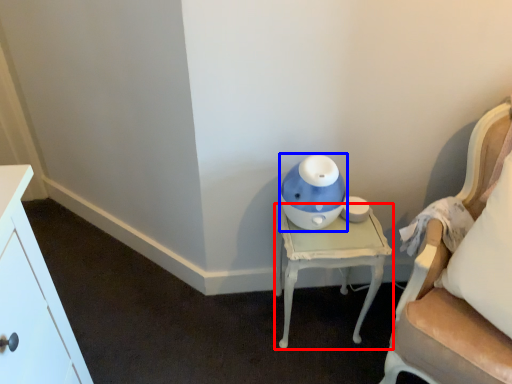
Question: Which object appears farthest to the camera in this image, nightstand (highlighted by a red box) or toy (highlighted by a blue box)?

Choices:
 (A) nightstand
 (B) toy

Answer: (A)